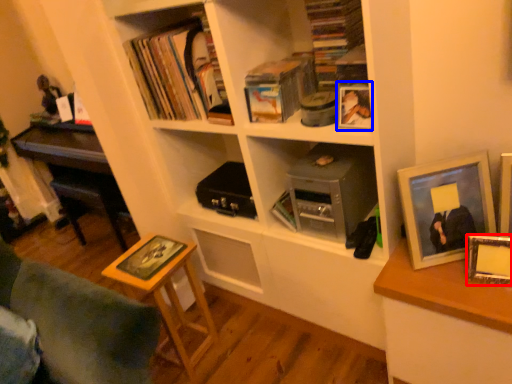
Question: Among these objects, which one is farthest to the camera, picture frame (highlighted by a red box) or picture frame (highlighted by a blue box)?

Choices:
 (A) picture frame
 (B) picture frame

Answer: (B)